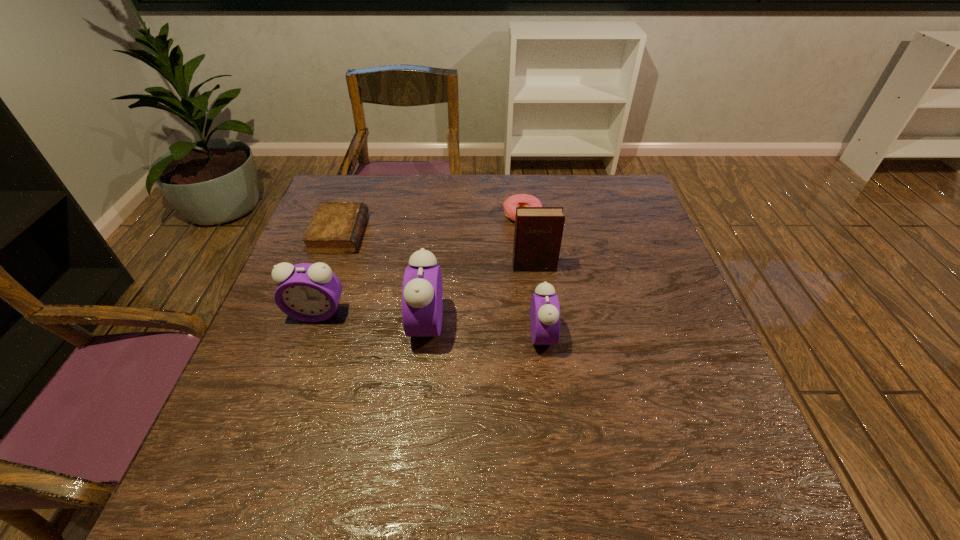
With all alarm clocks evenly spaced, where should an extra alarm clock be placed on the right to continue the pattern? Please point out a vacant space. Please provide its 2D coordinates. Your answer should be formatted as a tuple, i.e. [(x, y)], where the tuple contains the x and y coordinates of a point satisfying the conditions above.

[(663, 347)]